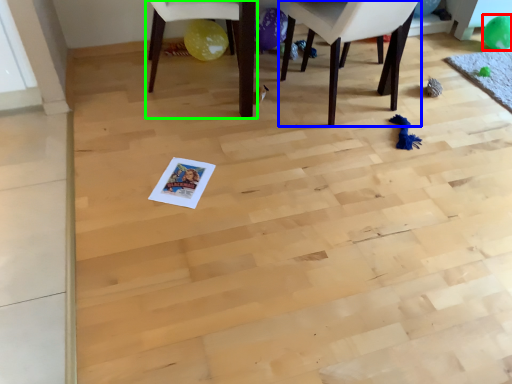
Question: Which object is positioned closest to balloon (highlighted by a red box)? Select from chair (highlighted by a blue box) and chair (highlighted by a green box).

Choices:
 (A) chair
 (B) chair

Answer: (A)